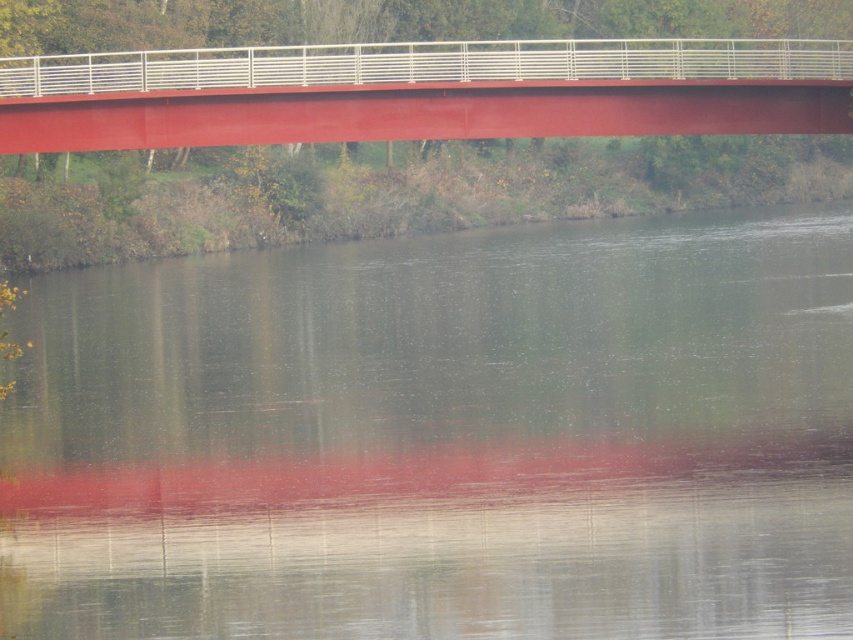
Question: Which object appears closest to the camera in this image?

Choices:
 (A) smooth water at center
 (B) metallic red bridge at upper center

Answer: (A)

Question: Does smooth water at center have a larger size compared to metallic red bridge at upper center?

Choices:
 (A) yes
 (B) no

Answer: (A)

Question: Can you confirm if smooth water at center is positioned to the left of metallic red bridge at upper center?

Choices:
 (A) no
 (B) yes

Answer: (A)

Question: Is the position of smooth water at center more distant than that of metallic red bridge at upper center?

Choices:
 (A) yes
 (B) no

Answer: (B)

Question: Which point is farther to the camera?

Choices:
 (A) metallic red bridge at upper center
 (B) smooth water at center

Answer: (A)